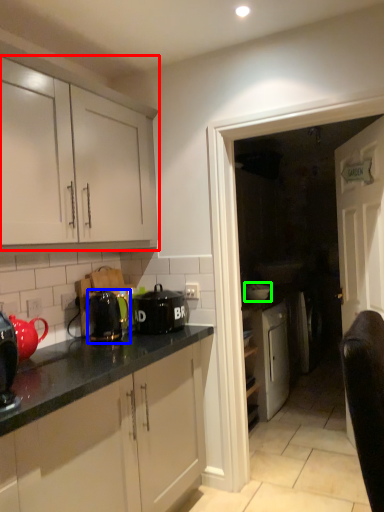
Question: Estimate the real-world distances between objects in this image. Which object is farther from cabinetry (highlighted by a red box), kitchen appliance (highlighted by a blue box) or appliance (highlighted by a green box)?

Choices:
 (A) kitchen appliance
 (B) appliance

Answer: (B)